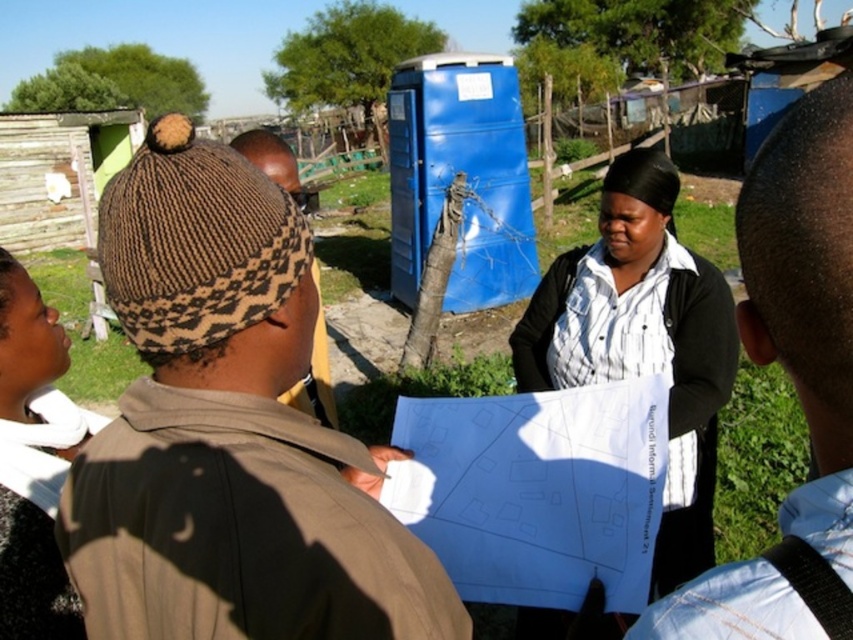
Question: Does light blue shirt at upper right have a greater width compared to white striped shirt at center?

Choices:
 (A) no
 (B) yes

Answer: (A)

Question: Which object is closer to the camera taking this photo?

Choices:
 (A) light blue shirt at upper right
 (B) brown knitted hat at upper left
 (C) white striped shirt at center
 (D) black knit hat at upper left

Answer: (A)

Question: Is brown knitted hat at upper left smaller than white striped shirt at center?

Choices:
 (A) yes
 (B) no

Answer: (A)

Question: Does brown knitted hat at upper left appear on the right side of light blue shirt at upper right?

Choices:
 (A) yes
 (B) no

Answer: (B)

Question: Considering the real-world distances, which object is closest to the black knit hat at upper left?

Choices:
 (A) light blue shirt at upper right
 (B) brown knitted hat at upper left

Answer: (B)

Question: Estimate the real-world distances between objects in this image. Which object is farther from the white striped shirt at center?

Choices:
 (A) light blue shirt at upper right
 (B) black knit hat at upper left
 (C) brown knitted hat at upper left

Answer: (B)